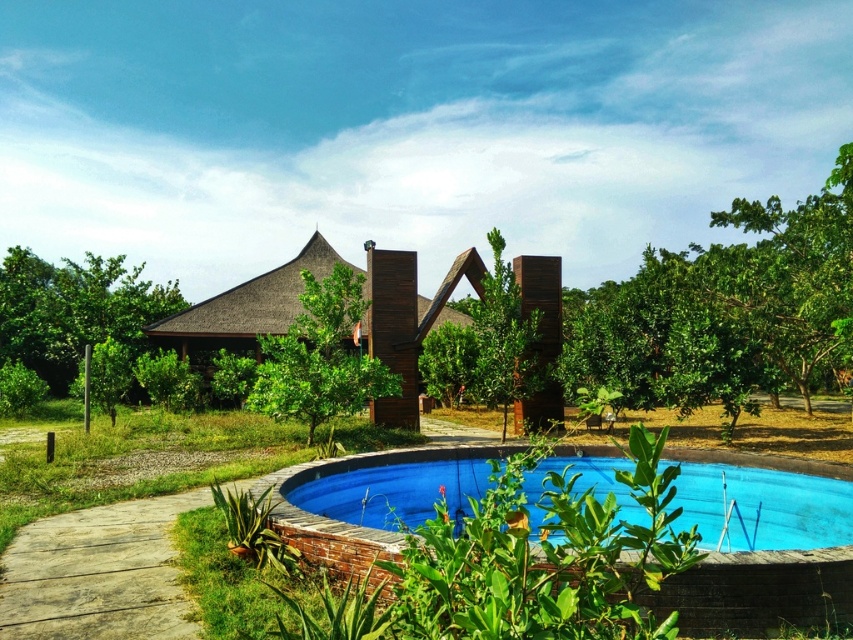
Question: Considering the relative positions of green leafy tree at upper right and green matte tree at center in the image provided, where is green leafy tree at upper right located with respect to green matte tree at center?

Choices:
 (A) left
 (B) right

Answer: (B)

Question: Which of the following is the farthest from the observer?

Choices:
 (A) (782, 342)
 (B) (508, 348)

Answer: (A)

Question: Can you confirm if blue ceramic swimming pool at lower center is positioned to the right of green matte tree at center?

Choices:
 (A) no
 (B) yes

Answer: (B)

Question: Does green leafy tree at upper right appear under brown wooden hut at center?

Choices:
 (A) no
 (B) yes

Answer: (A)

Question: Which of the following is the closest to the observer?

Choices:
 (A) green matte tree at center
 (B) green leafy tree at upper right
 (C) blue ceramic swimming pool at lower center
 (D) green leafy tree at center

Answer: (C)

Question: Estimate the real-world distances between objects in this image. Which object is closer to the green leafy tree at left?

Choices:
 (A) green leafy tree at upper right
 (B) green leafy tree at center

Answer: (B)